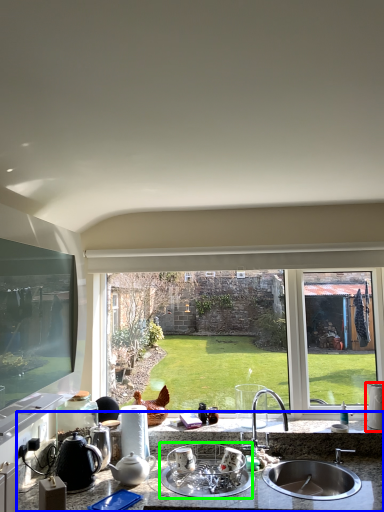
Question: Considering the real-world distances, which object is closest to appliance (highlighted by a red box)? countertop (highlighted by a blue box) or appliance (highlighted by a green box).

Choices:
 (A) countertop
 (B) appliance

Answer: (A)